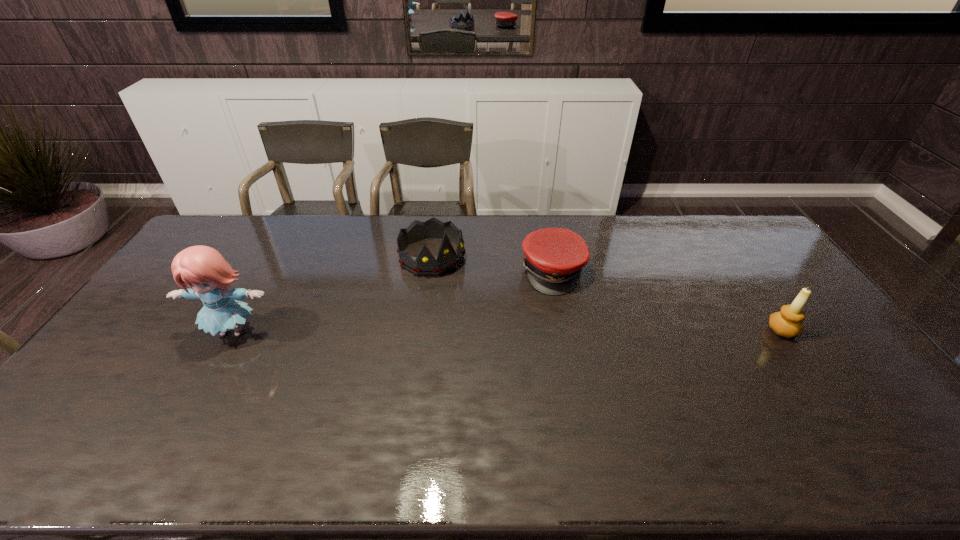
At what (x,y) coordinates should I click in order to perform the action: click on free space located 0.390m at the front of the third object from right to left with jewels. Please return your answer as a coordinate pair (x, y). This screenshot has height=540, width=960. Looking at the image, I should click on (519, 349).

Locate an element on the screen. Image resolution: width=960 pixels, height=540 pixels. vacant region located 0.330m on the front of the cap with an emblem is located at coordinates (606, 379).

Where is `vacant space positioned on the front of the cap with an emblem`? The height and width of the screenshot is (540, 960). vacant space positioned on the front of the cap with an emblem is located at coordinates (593, 353).

Where is `free location located on the front of the cap with an emblem`? free location located on the front of the cap with an emblem is located at coordinates (583, 332).

Where is `tiara present at the far edge`? tiara present at the far edge is located at coordinates pyautogui.click(x=425, y=264).

What are the coordinates of `cap that is positioned at the far edge` in the screenshot? It's located at (555, 257).

Locate an element on the screen. The width and height of the screenshot is (960, 540). object that is at the right edge is located at coordinates (787, 322).

This screenshot has width=960, height=540. I want to click on vacant region at the far edge of the desktop, so click(399, 221).

Locate an element on the screen. This screenshot has height=540, width=960. blank area at the near edge is located at coordinates (605, 397).

At what (x,y) coordinates should I click in order to perform the action: click on free space at the left edge of the desktop. Please return your answer as a coordinate pair (x, y). Looking at the image, I should click on (134, 381).